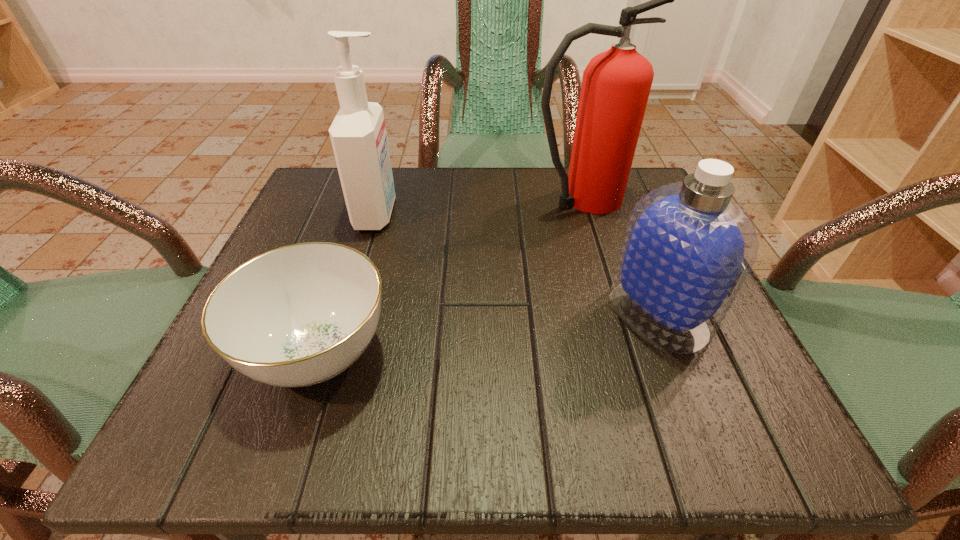
Where is `vacant region that satisfies the following two spatial constraints: 1. on the handle side of the fire extinguisher; 2. on the back side of the right cleansing agent`? This screenshot has height=540, width=960. vacant region that satisfies the following two spatial constraints: 1. on the handle side of the fire extinguisher; 2. on the back side of the right cleansing agent is located at coordinates (613, 314).